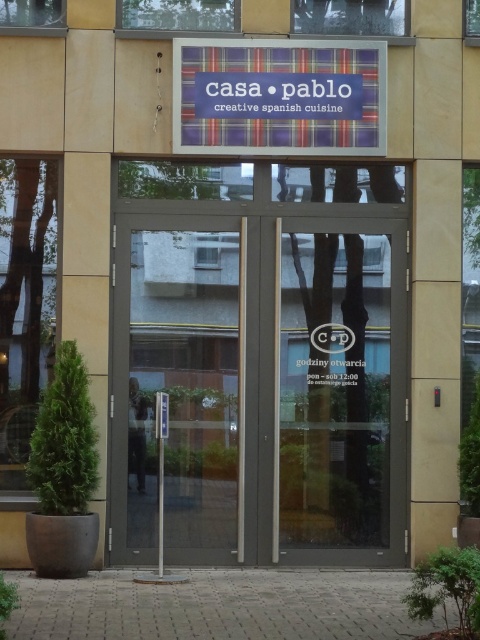
Question: Is plaid fabric sign at center to the left of silver metallic pole at center from the viewer's perspective?

Choices:
 (A) no
 (B) yes

Answer: (A)

Question: Which is farther from the plaid fabric sign at center?

Choices:
 (A) matte gray door at center
 (B) silver metallic pole at center
 (C) transparent glass door at center

Answer: (B)

Question: Does matte gray door at center come in front of transparent glass door at center?

Choices:
 (A) no
 (B) yes

Answer: (B)

Question: Which of the following is the farthest from the observer?

Choices:
 (A) (163, 554)
 (B) (288, 61)

Answer: (B)

Question: Where is transparent glass door at center located in relation to plaid fabric sign at center in the image?

Choices:
 (A) left
 (B) right

Answer: (B)

Question: Which point appears farthest from the camera in this image?

Choices:
 (A) (354, 499)
 (B) (134, 392)

Answer: (A)